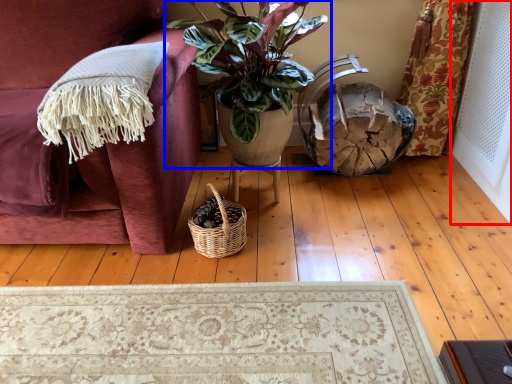
Question: Which object appears farthest to the camera in this image, screen door (highlighted by a red box) or houseplant (highlighted by a blue box)?

Choices:
 (A) screen door
 (B) houseplant

Answer: (B)